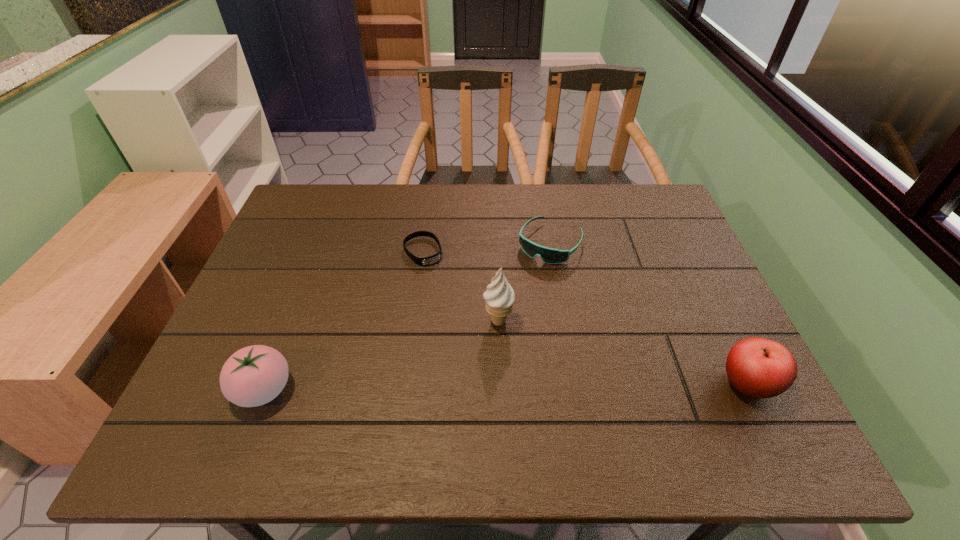
This screenshot has height=540, width=960. I want to click on vacant space at the far left corner of the desktop, so click(298, 192).

Locate an element on the screen. vacant area at the near left corner is located at coordinates (198, 403).

This screenshot has height=540, width=960. Find the location of `vacant area at the far right corner`. vacant area at the far right corner is located at coordinates tap(622, 193).

You are a GUI agent. You are given a task and a screenshot of the screen. Output one action in this format:
    pyautogui.click(x=<x>, y=<y>)
    Task: Click on the vacant space in between the second object from right to left and the third nearest object
    This screenshot has height=540, width=960.
    Given the screenshot: What is the action you would take?
    pyautogui.click(x=524, y=282)

Where is `free point between the apple and the tallest object`? free point between the apple and the tallest object is located at coordinates (622, 353).

The width and height of the screenshot is (960, 540). I want to click on vacant region between the leftmost object and the wristband, so click(344, 321).

I want to click on free space between the second shortest object and the wristband, so click(487, 247).

Locate an element on the screen. This screenshot has height=540, width=960. vacant area between the leftmost object and the apple is located at coordinates (505, 387).

Locate an element on the screen. The width and height of the screenshot is (960, 540). free area in between the wristband and the tomato is located at coordinates (344, 321).

Locate an element on the screen. This screenshot has height=540, width=960. vacant space that is in between the sunglasses and the shortest object is located at coordinates (487, 247).